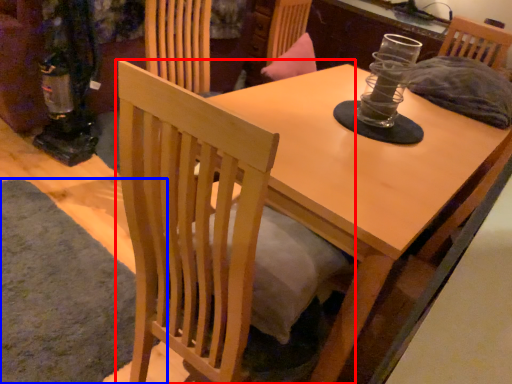
Question: Which object is further to the camera taking this photo, chair (highlighted by a red box) or mat (highlighted by a blue box)?

Choices:
 (A) chair
 (B) mat

Answer: (B)